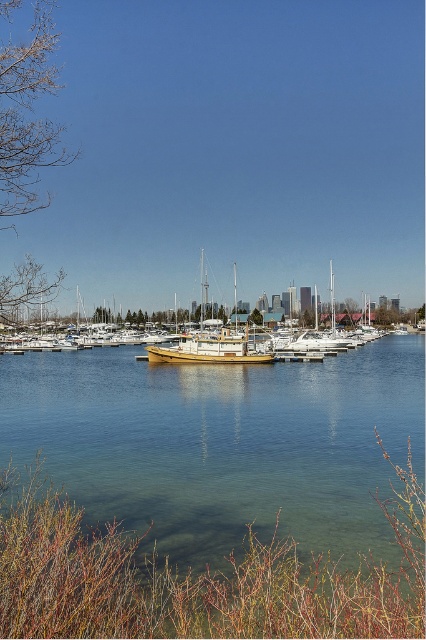
Is clear water at center bigger than wooden boat at center?

No, clear water at center is not bigger than wooden boat at center.

Does clear water at center come in front of wooden boat at center?

Yes, it is in front of wooden boat at center.

This screenshot has height=640, width=426. I want to click on clear water at center, so click(x=222, y=444).

Where is `clear water at center`? The width and height of the screenshot is (426, 640). clear water at center is located at coordinates (222, 444).

Who is more forward, [40,285] or [201,337]?

Positioned in front is point [40,285].

Who is more distant from viewer, (42, 296) or (180, 336)?

The point (180, 336) is more distant.

I want to click on wooden boat at center, so click(x=25, y=292).

Does clear water at center appear over wooden sailboat at center?

Incorrect, clear water at center is not positioned above wooden sailboat at center.

Can you confirm if clear water at center is taller than wooden sailboat at center?

No, clear water at center is not taller than wooden sailboat at center.

Between point (405, 424) and point (195, 353), which one is positioned behind?

Positioned behind is point (195, 353).

You are a GUI agent. You are given a task and a screenshot of the screen. Output one action in this format:
    pyautogui.click(x=<x>, y=<y>)
    Task: Click on the clear water at center
    
    Given the screenshot: What is the action you would take?
    pyautogui.click(x=222, y=444)